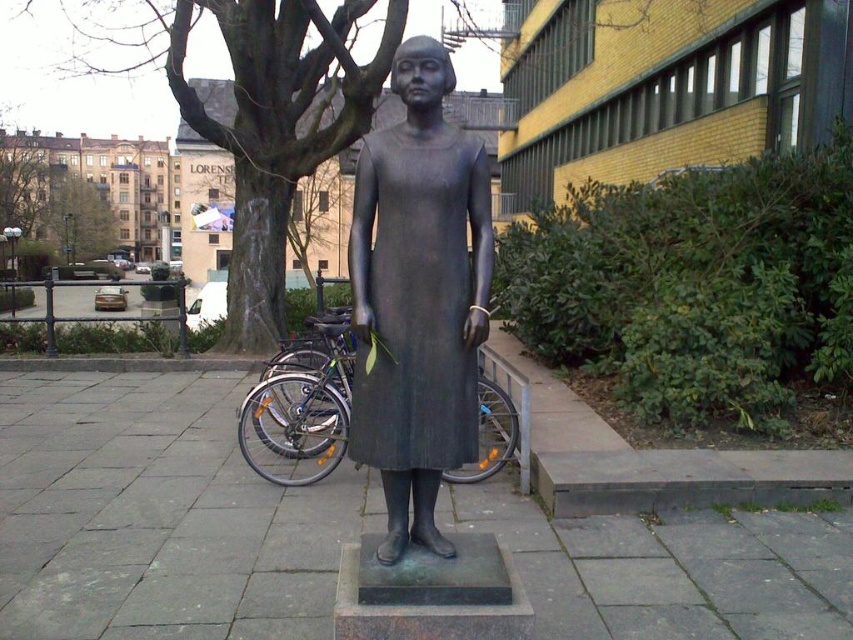
Question: Which point is farther to the camera?

Choices:
 (A) (372, 204)
 (B) (294, 20)

Answer: (B)

Question: Does matte bronze statue at center have a lesser width compared to green leafy tree at upper center?

Choices:
 (A) yes
 (B) no

Answer: (A)

Question: From the image, what is the correct spatial relationship of matte bronze statue at center in relation to dark brown bark tree at upper left?

Choices:
 (A) left
 (B) right

Answer: (B)

Question: Among these objects, which one is nearest to the camera?

Choices:
 (A) dark brown bark tree at upper left
 (B) green leafy tree at upper center
 (C) matte bronze statue at center

Answer: (C)

Question: Is matte bronze statue at center wider than dark brown bark tree at upper left?

Choices:
 (A) no
 (B) yes

Answer: (A)

Question: Which object is farther from the camera taking this photo?

Choices:
 (A) matte bronze statue at center
 (B) green leafy tree at upper center

Answer: (B)